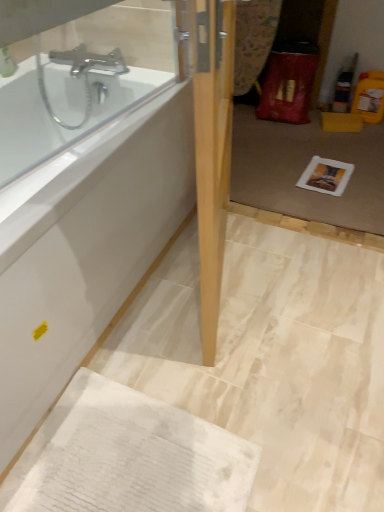
You are a GUI agent. You are given a task and a screenshot of the screen. Output one action in this format:
    pyautogui.click(x=<x>, y=<y>)
    Task: Click on the free point in front of transparent glass door at center
    This screenshot has width=384, height=512.
    Given the screenshot: What is the action you would take?
    pyautogui.click(x=306, y=293)